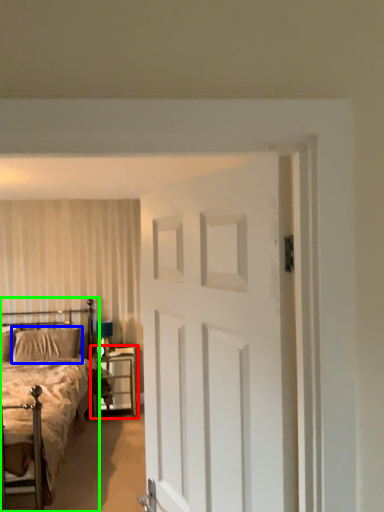
Question: Which is nearer to the nightstand (highlighted by a red box)? pillow (highlighted by a blue box) or bed (highlighted by a green box).

Choices:
 (A) pillow
 (B) bed

Answer: (A)